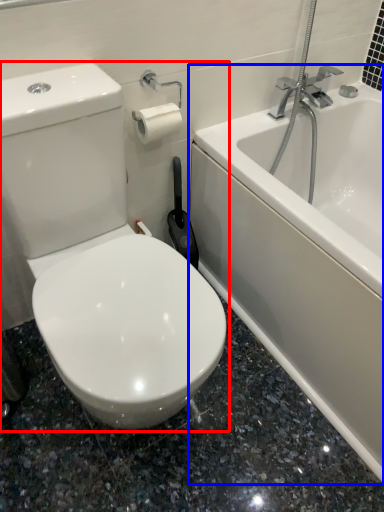
Question: Among these objects, which one is nearest to the camera, toilet (highlighted by a red box) or bathtub (highlighted by a blue box)?

Choices:
 (A) toilet
 (B) bathtub

Answer: (A)